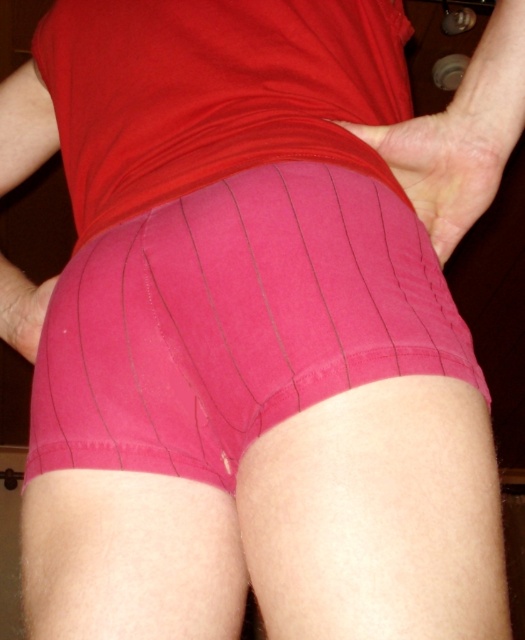
Question: Does dry skin at center have a larger size compared to pink fabric hand at lower left?

Choices:
 (A) yes
 (B) no

Answer: (B)

Question: Which of the following is the closest to the observer?

Choices:
 (A) pink fabric shorts at center
 (B) dry skin at center
 (C) pink fabric hand at lower left

Answer: (A)

Question: Does dry skin at center have a smaller size compared to pink fabric hand at lower left?

Choices:
 (A) no
 (B) yes

Answer: (B)

Question: Which object is closer to the camera taking this photo?

Choices:
 (A) pink fabric hand at lower left
 (B) dry skin at center

Answer: (B)

Question: In this image, where is pink fabric shorts at center located relative to pink fabric hand at lower left?

Choices:
 (A) left
 (B) right

Answer: (B)

Question: Which of the following is the closest to the observer?

Choices:
 (A) pink fabric shorts at center
 (B) pink fabric hand at lower left
 (C) dry skin at center

Answer: (A)